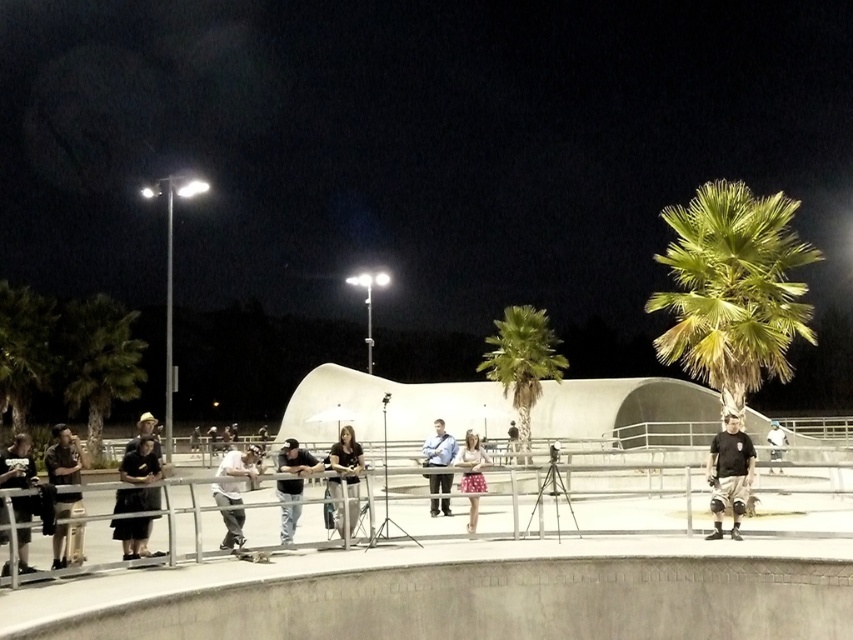
From the picture: You are a photographer at the skatepark and want to capture both the black matte shirt at lower right and the light pink fabric skirt at center in a single photo. Which object should you focus on first to ensure both are in frame?

The black matte shirt at lower right is taller than the light pink fabric skirt at center, so you should focus on the black matte shirt at lower right first to ensure both are in frame.

You are at the skatepark and want to borrow a jacket to stay warm. You see the matte black jacket at lower left and the light brown leather jacket at center. Which one is more likely to keep you warmer?

The light brown leather jacket at center is thicker than the matte black jacket at lower left, so it would provide better insulation and keep you warmer.

Consider the image. You are standing at the point marked by the coordinates (16, 464). Looking around the skatepark, you notice a matte black jacket at lower left. Can you determine the direction of the matte black jacket at lower left relative to your current position?

The matte black jacket at lower left is located at the point marked by your current position, so you are already at the location of the matte black jacket at lower left.